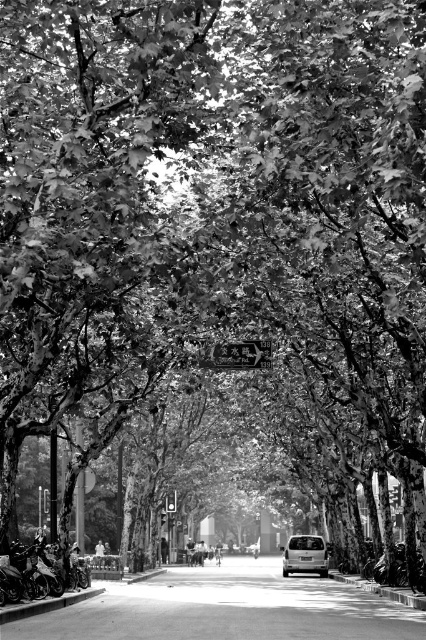
Does metallic reflective sign at center lie behind silver metallic van at center?

No, metallic reflective sign at center is closer to the viewer.

Is metallic reflective sign at center to the right of silver metallic van at center from the viewer's perspective?

In fact, metallic reflective sign at center is to the left of silver metallic van at center.

Does point (242, 365) come in front of point (302, 536)?

That is True.

Identify the location of metallic reflective sign at center. (238, 355).